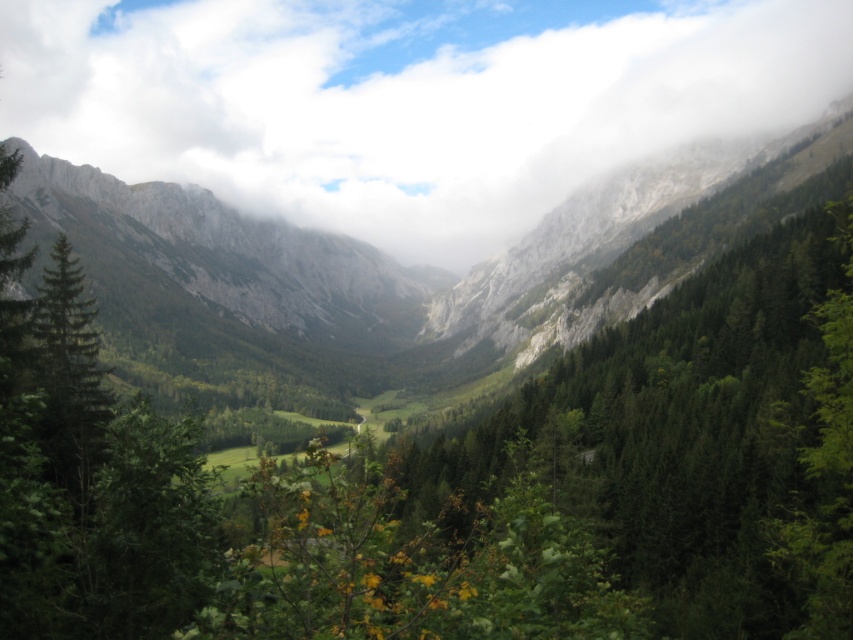
You are a hiker standing at the edge of the valley looking towards the mountains. You see the white fluffy cloud at center and the green matte forest at center. Which object is closer to you?

The white fluffy cloud at center is closer to you because the green matte forest at center is behind it.

You are a drone operator trying to capture a photo of the white fluffy cloud at center. The drone is currently at the top of the mountain. Which direction should you move the drone to reach the cloud?

The white fluffy cloud at center is located at point (405,100), so you should move the drone downward and to the left to reach it.